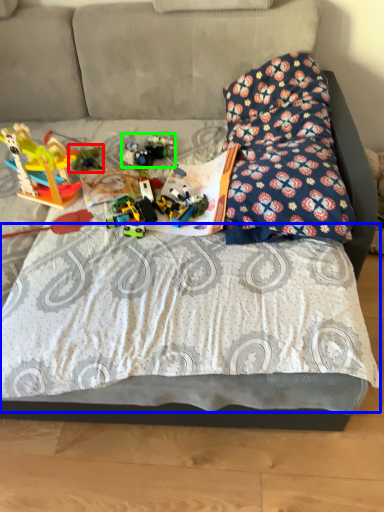
Question: Estimate the real-world distances between objects in this image. Which object is farther from toy (highlighted by a red box), sheet (highlighted by a blue box) or toy (highlighted by a green box)?

Choices:
 (A) sheet
 (B) toy

Answer: (A)